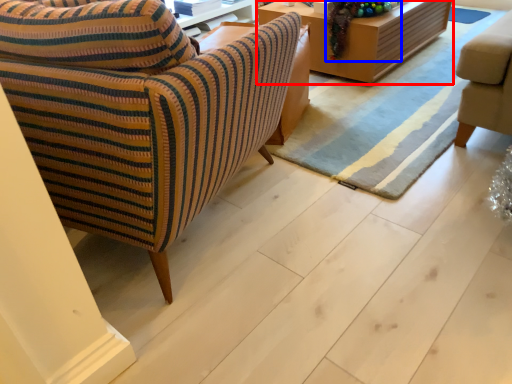
Question: Which object appears closest to the camera in this image, table (highlighted by a red box) or christmas decoration (highlighted by a blue box)?

Choices:
 (A) table
 (B) christmas decoration

Answer: (B)